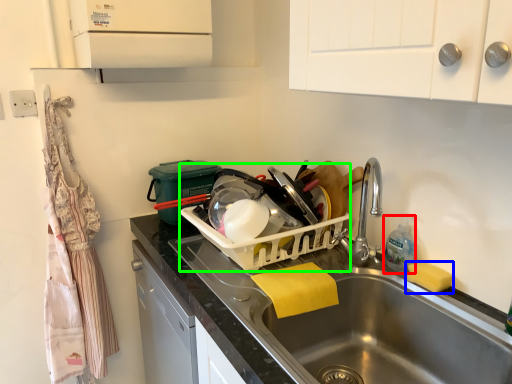
Question: Which is farther away from bottle (highlighted by a red box)? soap (highlighted by a blue box) or appliance (highlighted by a green box)?

Choices:
 (A) soap
 (B) appliance

Answer: (B)